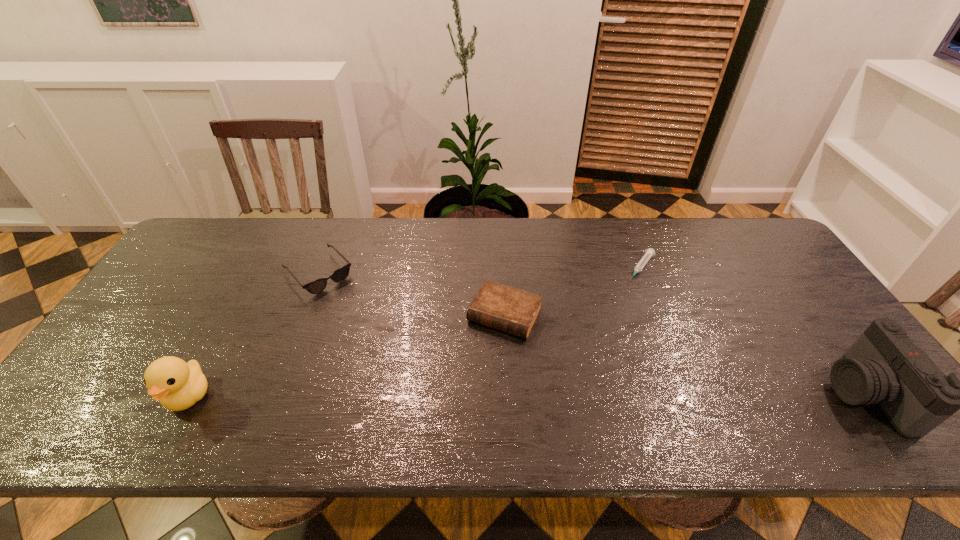
You are a GUI agent. You are given a task and a screenshot of the screen. Output one action in this format:
    pyautogui.click(x=<x>, y=<y>)
    Task: Click on the duck present at the near edge
    This screenshot has width=960, height=540.
    Given the screenshot: What is the action you would take?
    pyautogui.click(x=178, y=385)

The height and width of the screenshot is (540, 960). I want to click on camera at the near edge, so point(883,366).

Where is `object at the right edge`? The width and height of the screenshot is (960, 540). object at the right edge is located at coordinates (883, 366).

Identify the location of object located in the near right corner section of the desktop. Image resolution: width=960 pixels, height=540 pixels. (883, 366).

This screenshot has height=540, width=960. Identify the location of free region at the far edge of the desktop. (506, 259).

Locate an element on the screen. Image resolution: width=960 pixels, height=540 pixels. vacant point at the near edge is located at coordinates [621, 380].

Identify the location of vacant space at the left edge of the desktop. This screenshot has height=540, width=960. (219, 274).

Locate an element on the screen. This screenshot has width=960, height=540. free space at the right edge of the desktop is located at coordinates (773, 308).

Where is `vacant space at the far right corner`? The height and width of the screenshot is (540, 960). vacant space at the far right corner is located at coordinates (726, 225).

Identify the location of empty space that is in between the leftmost object and the sunglasses. The width and height of the screenshot is (960, 540). (253, 335).